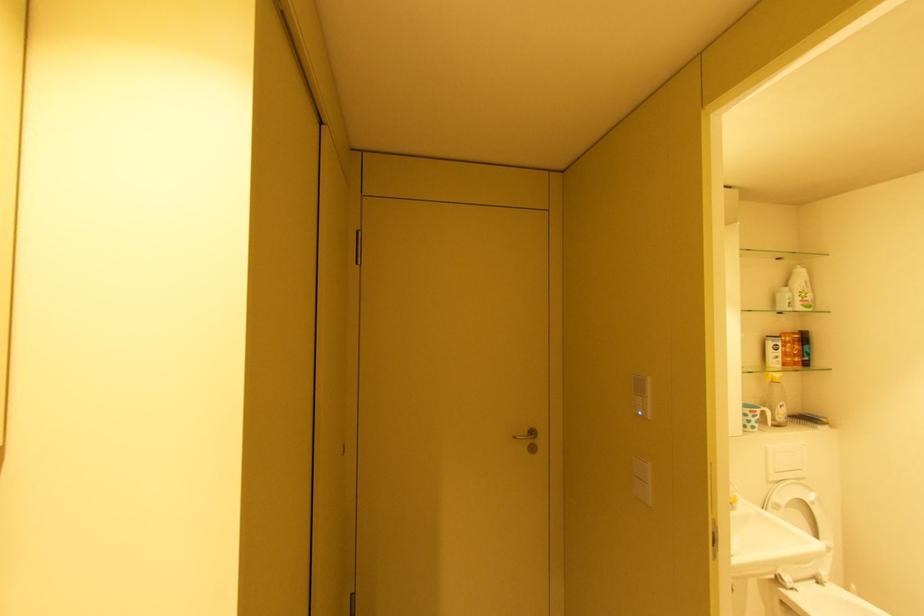
What do you see at coordinates (641, 395) in the screenshot? I see `the small light switch` at bounding box center [641, 395].